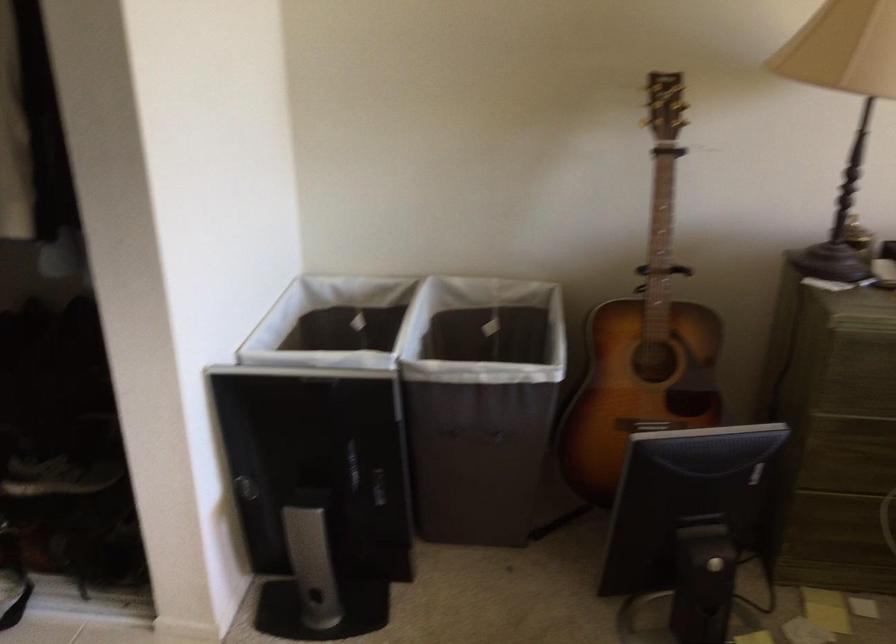
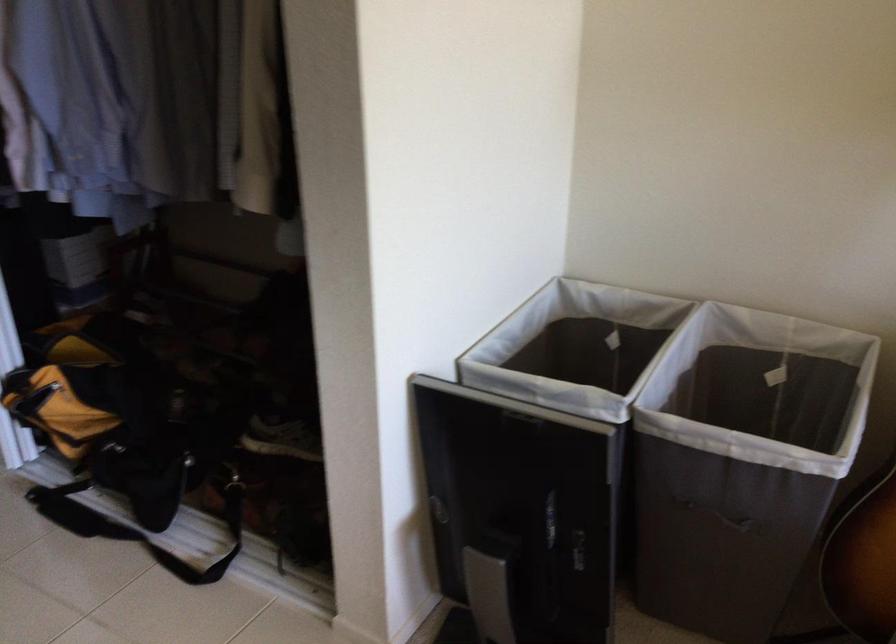
The point at (477, 440) is marked in the first image. Where is the corresponding point in the second image?

(719, 516)